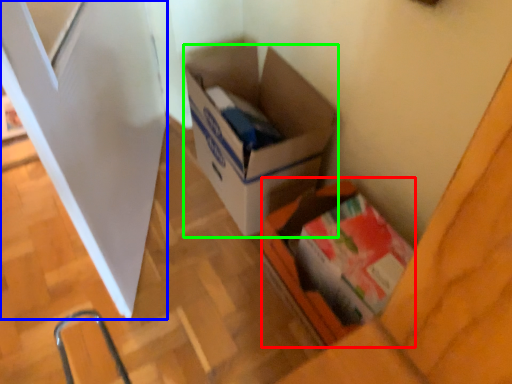
Question: Which object is the farthest from box (highlighted by a red box)? Choose among these: screen door (highlighted by a blue box) or box (highlighted by a green box).

Choices:
 (A) screen door
 (B) box

Answer: (A)